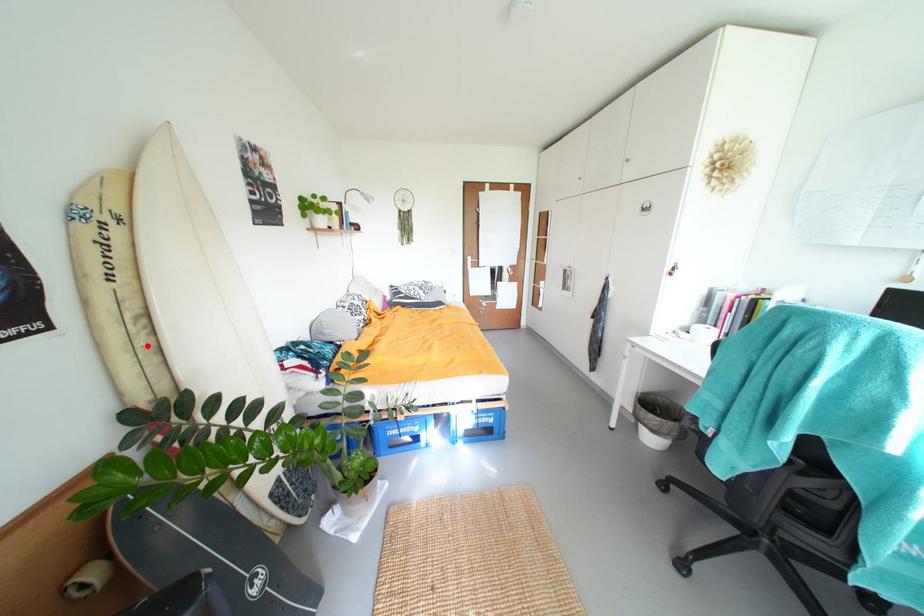
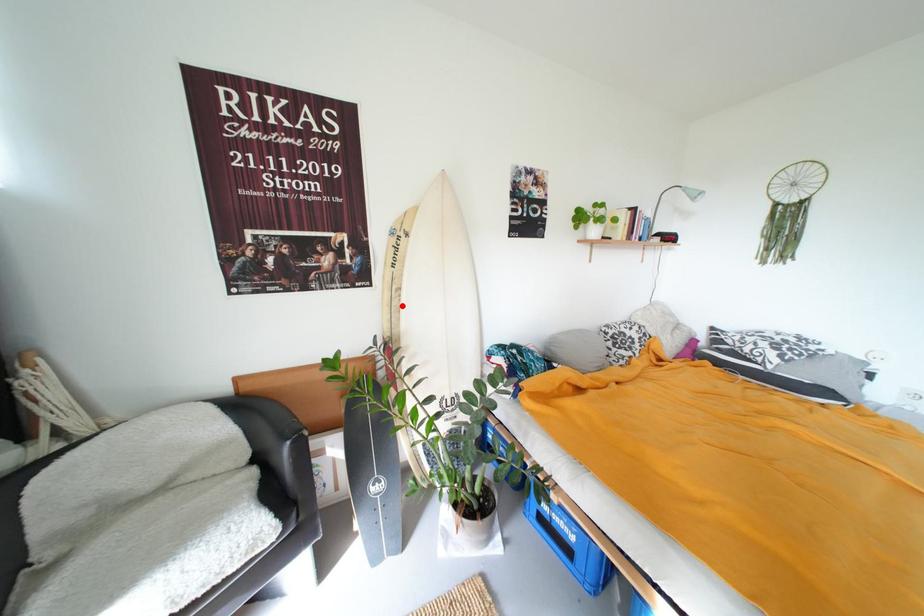
I am providing you with two images of the same scene from different viewpoints. A red point is marked on the first image and another point is marked on the second image. Does the point marked in image1 correspond to the same location as the one in image2?

Yes